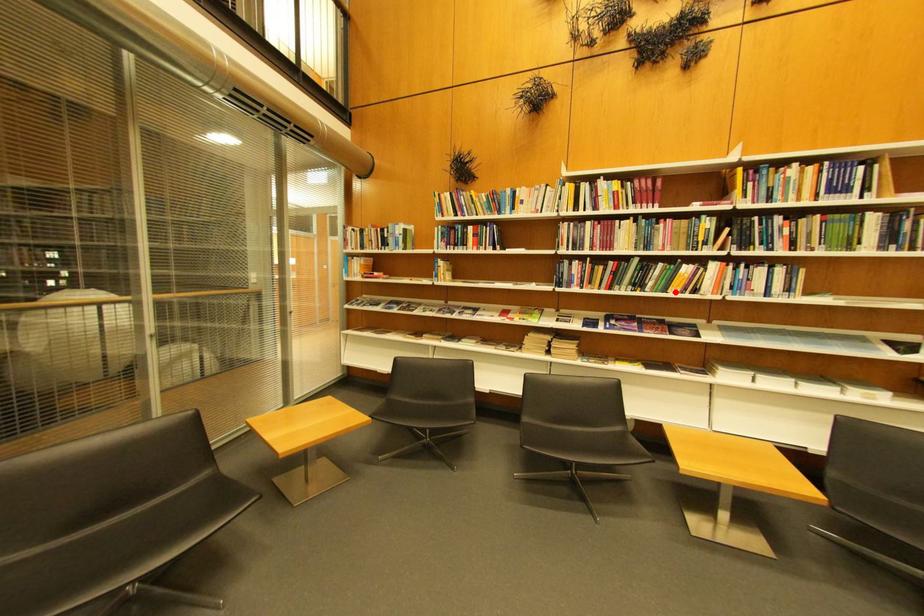
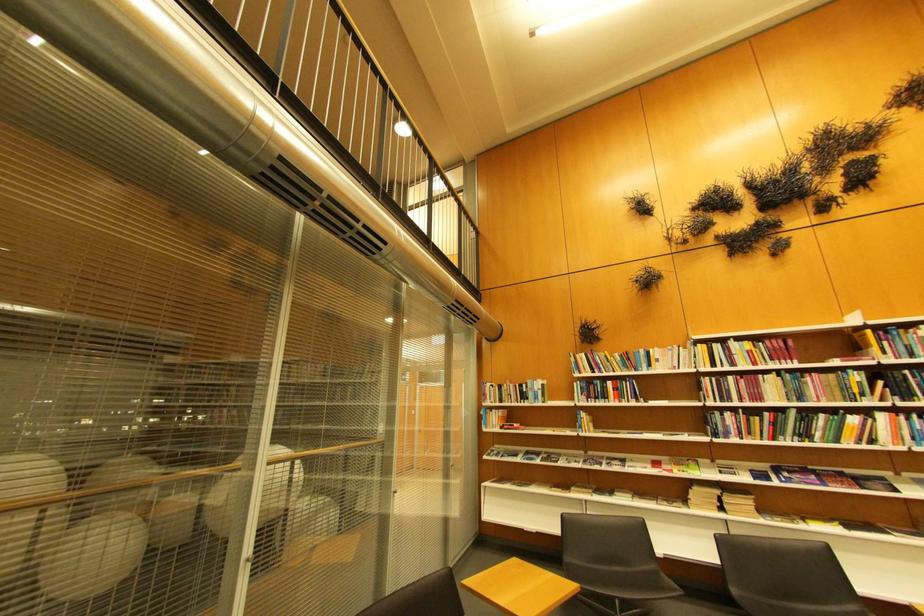
The point at the highlighted location is marked in the first image. Where is the corresponding point in the second image?

(847, 443)